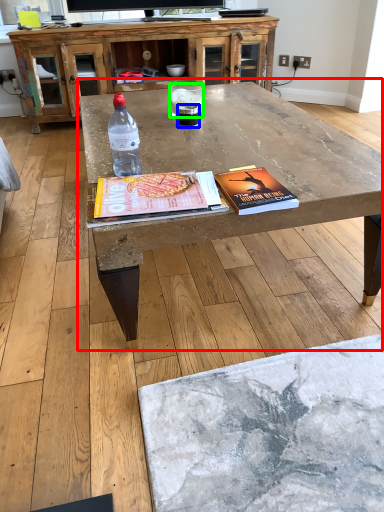
Question: Estimate the real-world distances between objects in this image. Which object is farther from coffee table (highlighted by a red box), beverage (highlighted by a blue box) or water (highlighted by a green box)?

Choices:
 (A) beverage
 (B) water

Answer: (A)